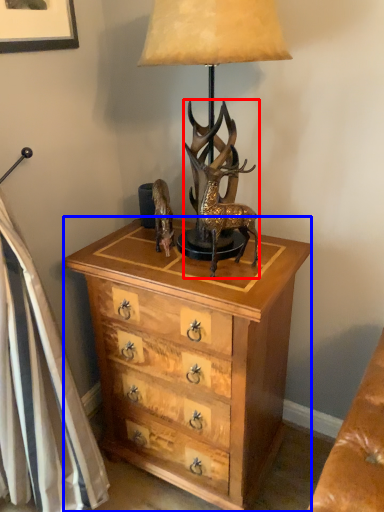
Question: Which point is closer to the camera, deer (highlighted by a red box) or chest of drawers (highlighted by a blue box)?

Choices:
 (A) deer
 (B) chest of drawers

Answer: (A)